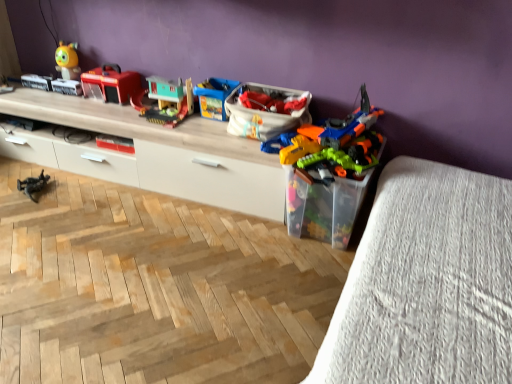
I want to click on free space behind metallic gray toy soldier at lower left, marked as the 1th toy in a left-to-right arrangement, so click(47, 172).